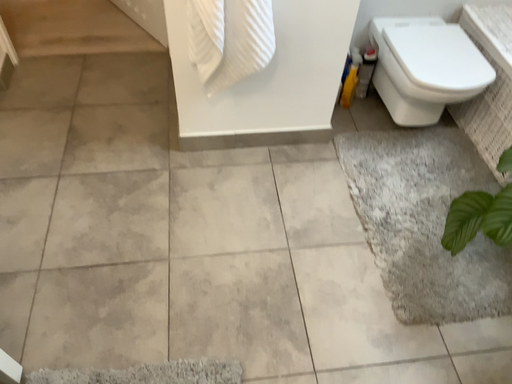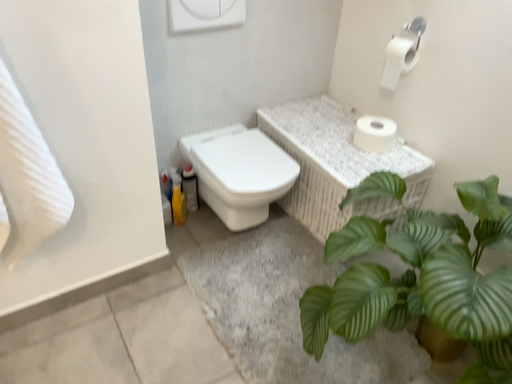
Question: How did the camera likely rotate when shooting the video?

Choices:
 (A) rotated left
 (B) rotated right

Answer: (B)